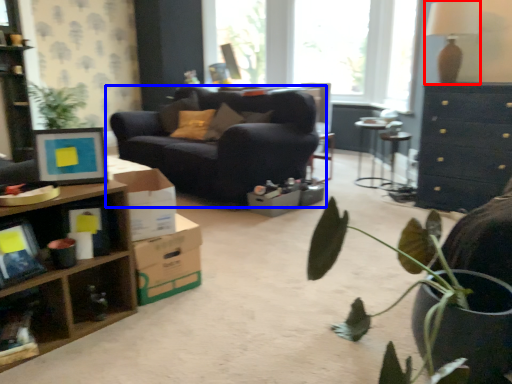
Question: Among these objects, which one is farthest to the camera, lamp (highlighted by a red box) or studio couch (highlighted by a blue box)?

Choices:
 (A) lamp
 (B) studio couch

Answer: (B)